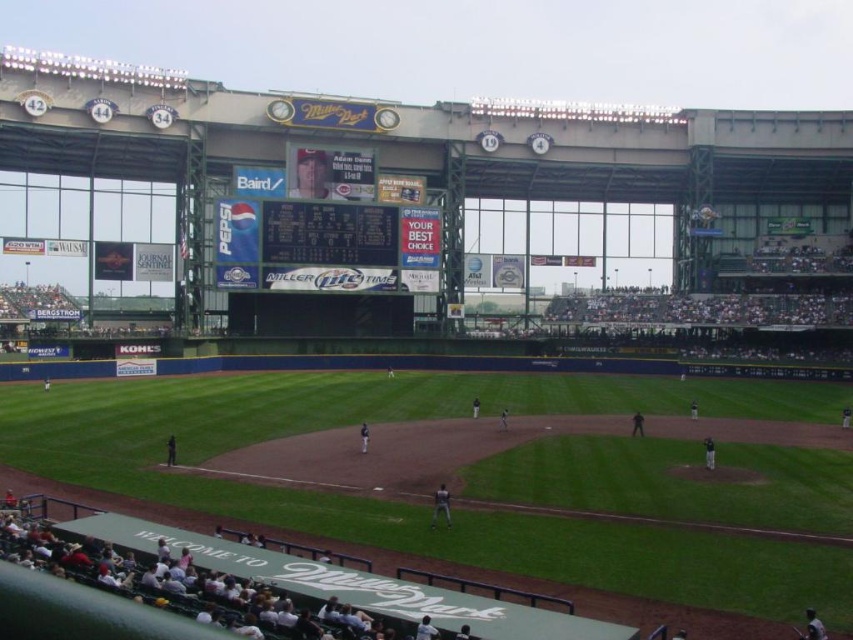
Question: Considering the real-world distances, which object is farthest from the black plastic scoreboard at center?

Choices:
 (A) dark green fabric banner at lower center
 (B) green grass field at center

Answer: (A)

Question: Is black plastic scoreboard at center positioned before dark gray uniform at center?

Choices:
 (A) yes
 (B) no

Answer: (B)

Question: Which of the following is the farthest from the observer?

Choices:
 (A) black plastic scoreboard at center
 (B) green grass field at center
 (C) dark green fabric banner at lower center

Answer: (A)

Question: Can you confirm if dark green fabric banner at lower center is bigger than dark gray uniform at center?

Choices:
 (A) yes
 (B) no

Answer: (A)

Question: Considering the relative positions of dark green fabric banner at lower center and black plastic scoreboard at center in the image provided, where is dark green fabric banner at lower center located with respect to black plastic scoreboard at center?

Choices:
 (A) above
 (B) below

Answer: (B)

Question: Among these points, which one is farthest from the camera?

Choices:
 (A) (328, 252)
 (B) (824, 593)
 (C) (445, 493)
 (D) (285, 628)

Answer: (A)